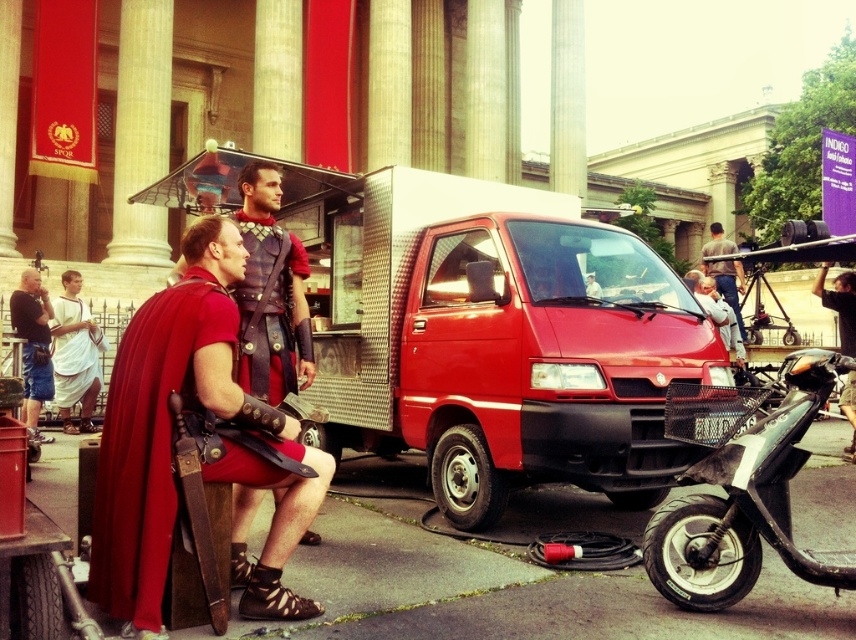
Question: Which point appears farthest from the camera in this image?

Choices:
 (A) (25, 368)
 (B) (409, 218)
 (C) (189, 280)

Answer: (A)

Question: Which object is farther from the camera taking this photo?

Choices:
 (A) smooth black helmet at upper right
 (B) matte black camera at left

Answer: (B)

Question: Can you confirm if metallic red van at center is positioned above shiny black scooter at lower right?

Choices:
 (A) yes
 (B) no

Answer: (A)

Question: Can you confirm if metallic red van at center is thinner than white cotton toga at left?

Choices:
 (A) yes
 (B) no

Answer: (B)

Question: Which of the following is the farthest from the observer?

Choices:
 (A) (681, 592)
 (B) (714, 248)

Answer: (B)

Question: Is white cotton toga at left bigger than smooth black helmet at upper right?

Choices:
 (A) yes
 (B) no

Answer: (B)